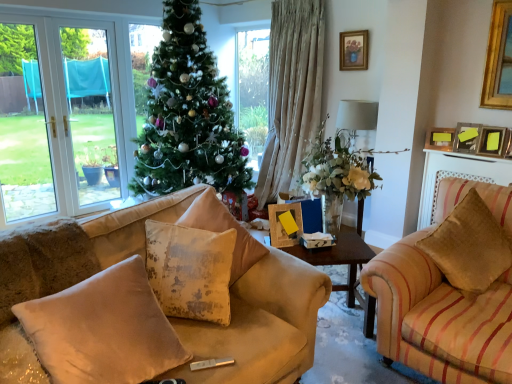
Question: Is wooden picture frame at upper right, which appears as the 2th picture frame when ordered from the bottom, not close to wooden picture frame at upper right, which appears as the 2th picture frame when viewed from the top?

Choices:
 (A) yes
 (B) no

Answer: (B)

Question: From the image's perspective, is wooden picture frame at upper right, the third picture frame from the left, over wooden picture frame at upper right, positioned as the 3th picture frame in right-to-left order?

Choices:
 (A) yes
 (B) no

Answer: (B)

Question: Is wooden picture frame at upper right, the third picture frame from the left, not within wooden picture frame at upper right, placed as the second picture frame when sorted from back to front?

Choices:
 (A) yes
 (B) no

Answer: (A)

Question: Is wooden picture frame at upper right, the third picture frame from the left, beside wooden picture frame at upper right, positioned as the 3th picture frame in right-to-left order?

Choices:
 (A) no
 (B) yes

Answer: (A)

Question: Considering the relative sizes of wooden picture frame at upper right, the second picture frame when ordered from right to left, and wooden picture frame at upper right, placed as the second picture frame when sorted from back to front, in the image provided, is wooden picture frame at upper right, the second picture frame when ordered from right to left, wider than wooden picture frame at upper right, placed as the second picture frame when sorted from back to front,?

Choices:
 (A) yes
 (B) no

Answer: (B)

Question: Is wooden picture frame at upper right, the second picture frame when ordered from right to left, positioned before wooden picture frame at upper right, positioned as the 3th picture frame in right-to-left order?

Choices:
 (A) no
 (B) yes

Answer: (B)

Question: From a real-world perspective, is wooden picture frame at upper right, which appears as the 2th picture frame when viewed from the top, on top of velvet beige pillow at right, the 1th pillow in the right-to-left sequence?

Choices:
 (A) no
 (B) yes

Answer: (B)

Question: Is there a large distance between wooden picture frame at upper right, placed as the second picture frame when sorted from back to front, and velvet beige pillow at right, the 1th pillow in the right-to-left sequence?

Choices:
 (A) yes
 (B) no

Answer: (A)

Question: Is wooden picture frame at upper right, the third picture frame in the bottom-to-top sequence, oriented away from velvet beige pillow at right, the 1th pillow in the right-to-left sequence?

Choices:
 (A) yes
 (B) no

Answer: (B)

Question: Is wooden picture frame at upper right, which is the 2th picture frame from left to right, further to the viewer compared to velvet beige pillow at right, the 1th pillow in the right-to-left sequence?

Choices:
 (A) yes
 (B) no

Answer: (A)

Question: Does wooden picture frame at upper right, which appears as the 2th picture frame when viewed from the top, have a greater width compared to velvet beige pillow at right, placed as the fourth pillow when sorted from left to right?

Choices:
 (A) no
 (B) yes

Answer: (A)

Question: Is wooden picture frame at upper right, the 3th picture frame positioned from the front, to the right of velvet beige pillow at right, placed as the fourth pillow when sorted from left to right, from the viewer's perspective?

Choices:
 (A) yes
 (B) no

Answer: (A)

Question: Considering the relative sizes of gold-framed picture at upper center, the 4th picture frame in the bottom-to-top sequence, and wooden picture frame at upper right, acting as the first picture frame starting from the front, in the image provided, is gold-framed picture at upper center, the 4th picture frame in the bottom-to-top sequence, thinner than wooden picture frame at upper right, acting as the first picture frame starting from the front,?

Choices:
 (A) no
 (B) yes

Answer: (B)